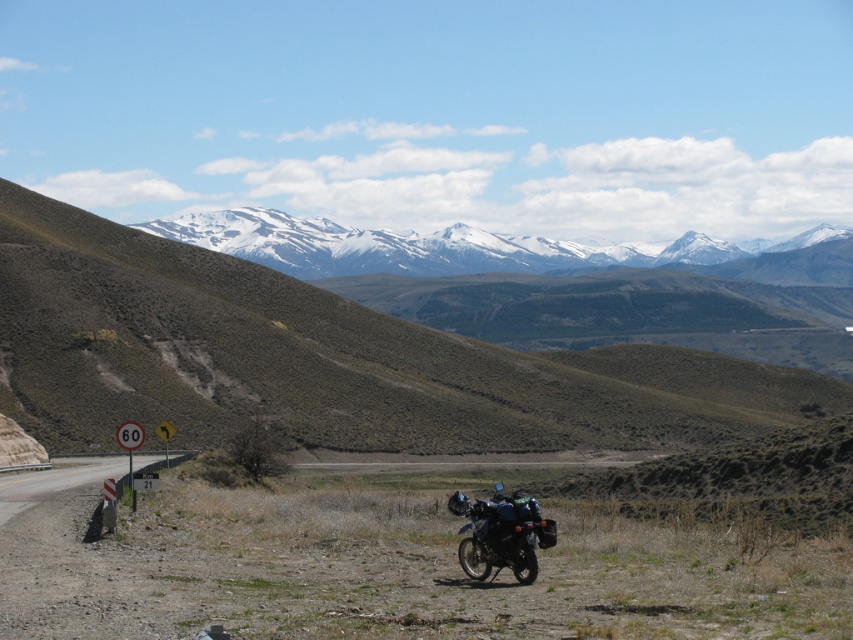
You are a hiker planning to take a photo of the snowy granite mountain range at upper center from the dirt road. Where should you position yourself relative to the motorcycle parked on the right side of the road to ensure the mountain range is fully visible in your shot?

To ensure the snowy granite mountain range at upper center is fully visible, you should position yourself on the left side of the road opposite the motorcycle. This placement will allow the mountain range, located at coordinates point [495,250], to be centered in your view without obstruction from the motorcycle or other road elements.

You are a traveler planning to take a photo of both the brushed metal signpost at left and the metallic road sign at lower left. Which sign should you position closer to the camera to ensure both are visible in the frame?

Since the brushed metal signpost at left is wider than the metallic road sign at lower left, you should position the metallic road sign at lower left closer to the camera to ensure both fit within the frame.